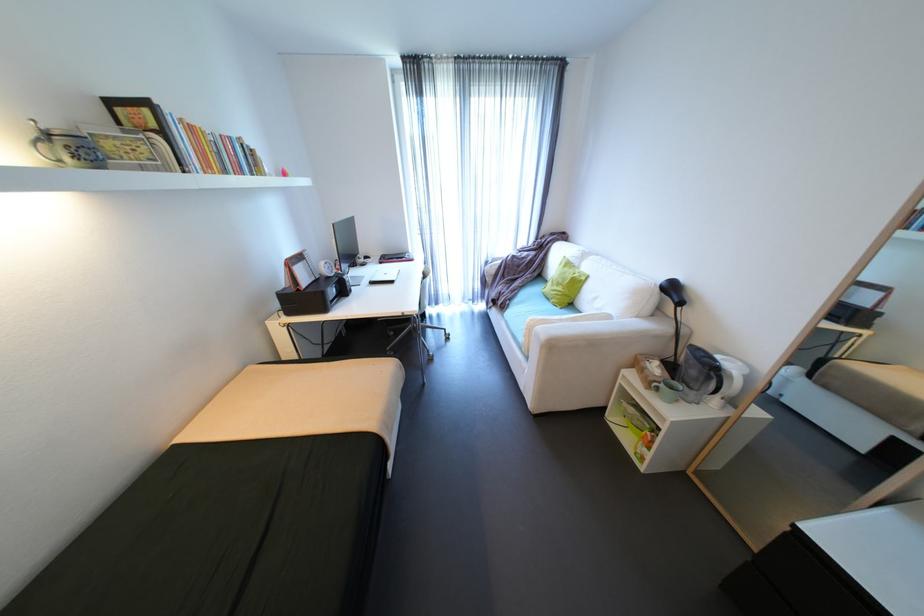
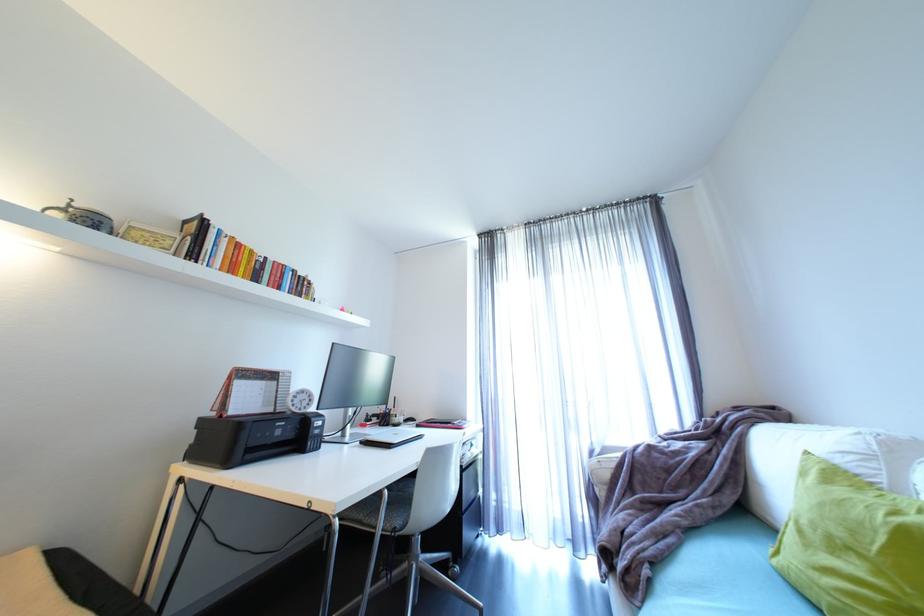
Locate, in the second image, the point that corresponds to pixel 410 257 in the first image.

(457, 424)